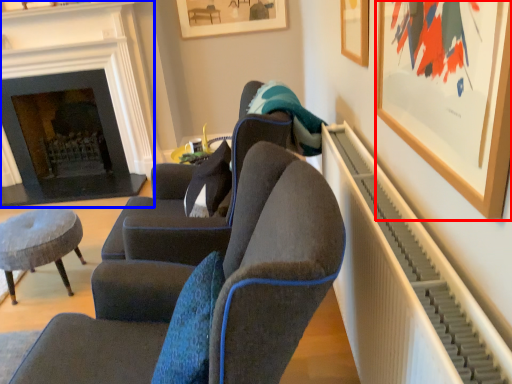
Question: Which object is further to the camera taking this photo, picture frame (highlighted by a red box) or fireplace (highlighted by a blue box)?

Choices:
 (A) picture frame
 (B) fireplace

Answer: (B)